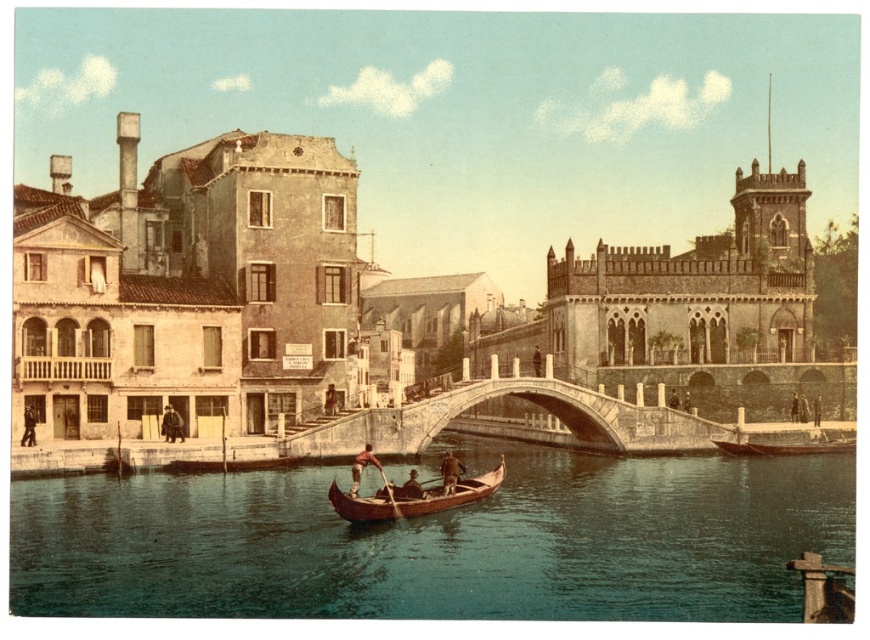
Is brown leather boat at center shorter than smooth brown leather oar at center?

In fact, brown leather boat at center may be taller than smooth brown leather oar at center.

Does brown leather boat at center have a greater width compared to smooth brown leather oar at center?

Incorrect, brown leather boat at center's width does not surpass smooth brown leather oar at center's.

Which is behind, point (452, 472) or point (357, 492)?

The point (452, 472) is behind.

Identify the location of brown leather boat at center. (450, 472).

Can you confirm if teal smooth water at center is taller than brown leather hat at center?

Incorrect, teal smooth water at center's height is not larger of brown leather hat at center's.

Locate an element on the screen. The width and height of the screenshot is (870, 640). teal smooth water at center is located at coordinates (439, 541).

The image size is (870, 640). Describe the element at coordinates (439, 541) in the screenshot. I see `teal smooth water at center` at that location.

This screenshot has width=870, height=640. I want to click on teal smooth water at center, so click(x=439, y=541).

Looking at this image, is teal smooth water at center smaller than wooden canoe at center?

Incorrect, teal smooth water at center is not smaller in size than wooden canoe at center.

Does teal smooth water at center appear on the left side of wooden canoe at center?

Incorrect, teal smooth water at center is not on the left side of wooden canoe at center.

What do you see at coordinates (439, 541) in the screenshot? This screenshot has width=870, height=640. I see `teal smooth water at center` at bounding box center [439, 541].

This screenshot has height=640, width=870. Find the location of `teal smooth water at center`. teal smooth water at center is located at coordinates (439, 541).